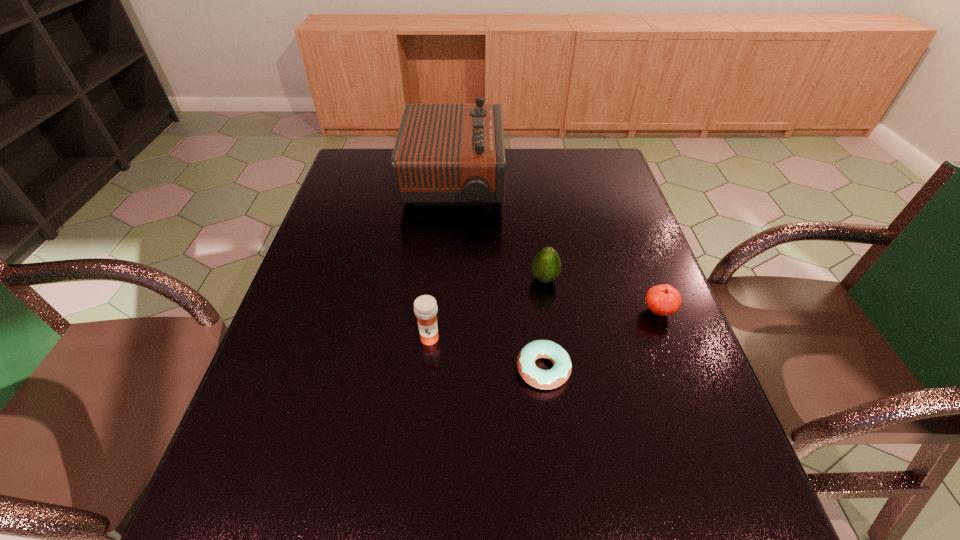
Select which object is the second closest to the radio receiver. Please provide its 2D coordinates. Your answer should be formatted as a tuple, i.e. [(x, y)], where the tuple contains the x and y coordinates of a point satisfying the conditions above.

[(425, 307)]

Find the location of a particular element. Image resolution: width=960 pixels, height=540 pixels. vacant area that satisfies the following two spatial constraints: 1. on the tuning display of the tallest object; 2. on the label side of the medicine is located at coordinates (442, 338).

Locate an element on the screen. Image resolution: width=960 pixels, height=540 pixels. vacant point that satisfies the following two spatial constraints: 1. on the tuning display of the radio receiver; 2. on the back side of the doughnut is located at coordinates (439, 369).

This screenshot has width=960, height=540. Find the location of `free space that satisfies the following two spatial constraints: 1. on the back side of the avocado; 2. on the left side of the shortest object`. free space that satisfies the following two spatial constraints: 1. on the back side of the avocado; 2. on the left side of the shortest object is located at coordinates (533, 279).

Where is `vacant area that satisfies the following two spatial constraints: 1. on the tuning display of the farthest object; 2. on the label side of the medicine`? This screenshot has width=960, height=540. vacant area that satisfies the following two spatial constraints: 1. on the tuning display of the farthest object; 2. on the label side of the medicine is located at coordinates (442, 338).

Locate an element on the screen. This screenshot has height=540, width=960. free space that satisfies the following two spatial constraints: 1. on the tuning display of the tallest object; 2. on the label side of the medicine is located at coordinates (442, 338).

Locate an element on the screen. free space that satisfies the following two spatial constraints: 1. on the label side of the medicine; 2. on the left side of the shortest object is located at coordinates (426, 369).

I want to click on vacant space that satisfies the following two spatial constraints: 1. on the tuning display of the apple; 2. on the left side of the farthest object, so click(444, 312).

In order to click on free space that satisfies the following two spatial constraints: 1. on the label side of the medicine; 2. on the left side of the shortest object in this screenshot , I will do `click(426, 369)`.

Locate an element on the screen. The height and width of the screenshot is (540, 960). blank area in the image that satisfies the following two spatial constraints: 1. on the back side of the shortest object; 2. on the left side of the rightmost object is located at coordinates (537, 312).